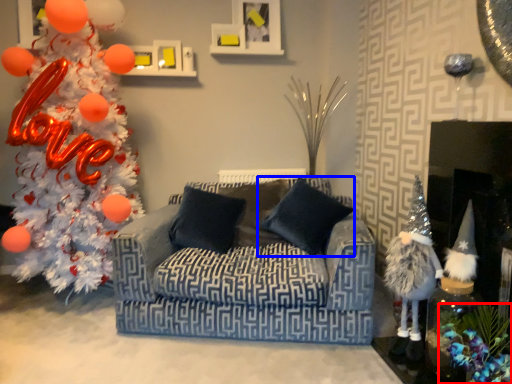
Question: Which object appears closest to the camera in this image, christmas decoration (highlighted by a red box) or pillow (highlighted by a blue box)?

Choices:
 (A) christmas decoration
 (B) pillow

Answer: (A)